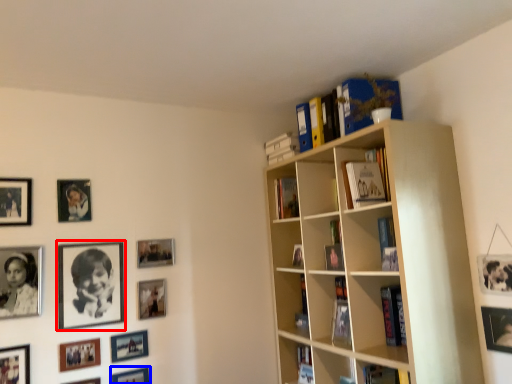
Question: Which object is closer to the camera taking this photo, picture frame (highlighted by a red box) or picture frame (highlighted by a blue box)?

Choices:
 (A) picture frame
 (B) picture frame

Answer: (A)